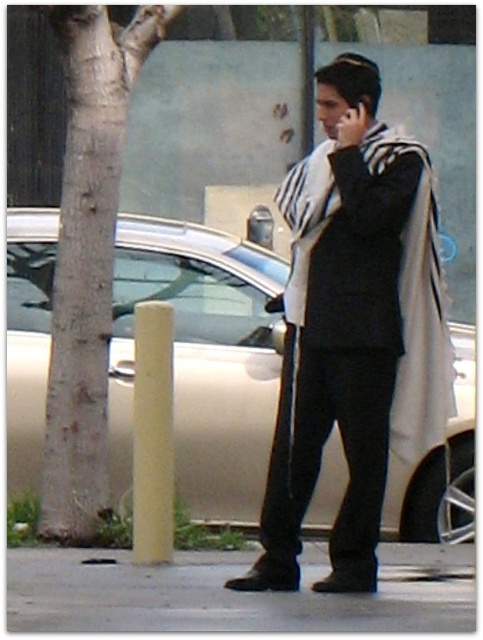
Is gray bark tree at left bigger than gray concrete sidewalk at lower center?

Yes.

Between gray bark tree at left and gray concrete sidewalk at lower center, which one is positioned lower?

gray concrete sidewalk at lower center is lower down.

Is point (71, 280) positioned after point (123, 595)?

Yes, point (71, 280) is farther from viewer.

Locate an element on the screen. gray bark tree at left is located at coordinates (87, 253).

Is silver metallic car at center closer to the viewer compared to gray bark tree at left?

No, it is not.

Does silver metallic car at center appear on the left side of gray bark tree at left?

In fact, silver metallic car at center is to the right of gray bark tree at left.

Locate an element on the screen. The height and width of the screenshot is (640, 483). silver metallic car at center is located at coordinates (x=200, y=358).

Who is taller, striped wool scarf at center or gray concrete sidewalk at lower center?

striped wool scarf at center is taller.

Who is lower down, striped wool scarf at center or gray concrete sidewalk at lower center?

gray concrete sidewalk at lower center is lower down.

Measure the distance between point (347, 428) and camera.

Point (347, 428) is 5.97 meters from camera.

Where is `striped wool scarf at center`? striped wool scarf at center is located at coordinates (349, 326).